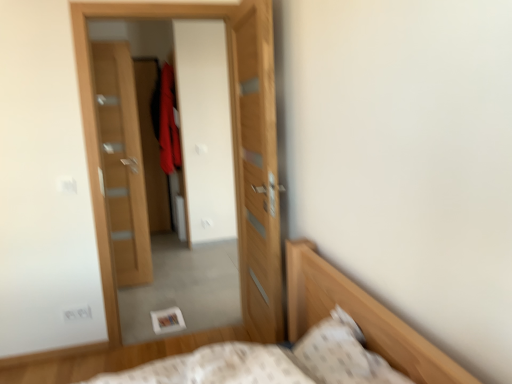
Question: Would you say velvet red robe at center is to the left or to the right of white textured pillow at lower right in the picture?

Choices:
 (A) left
 (B) right

Answer: (A)

Question: Is velvet red robe at center taller or shorter than white textured pillow at lower right?

Choices:
 (A) short
 (B) tall

Answer: (B)

Question: Based on their relative distances, which object is farther from the velvet red robe at center?

Choices:
 (A) wooden door at center, the first door in the front-to-back sequence
 (B) wooden door at center, which ranks as the second door in back-to-front order
 (C) white textured pillow at lower right
 (D) wooden door at left, which appears as the first door when viewed from the left

Answer: (C)

Question: Which is farther from the velvet red robe at center?

Choices:
 (A) wooden door at center, acting as the third door starting from the left
 (B) white textured pillow at lower right
 (C) wooden door at center, the 2th door when ordered from right to left
 (D) wooden door at left, the third door in the front-to-back sequence

Answer: (B)